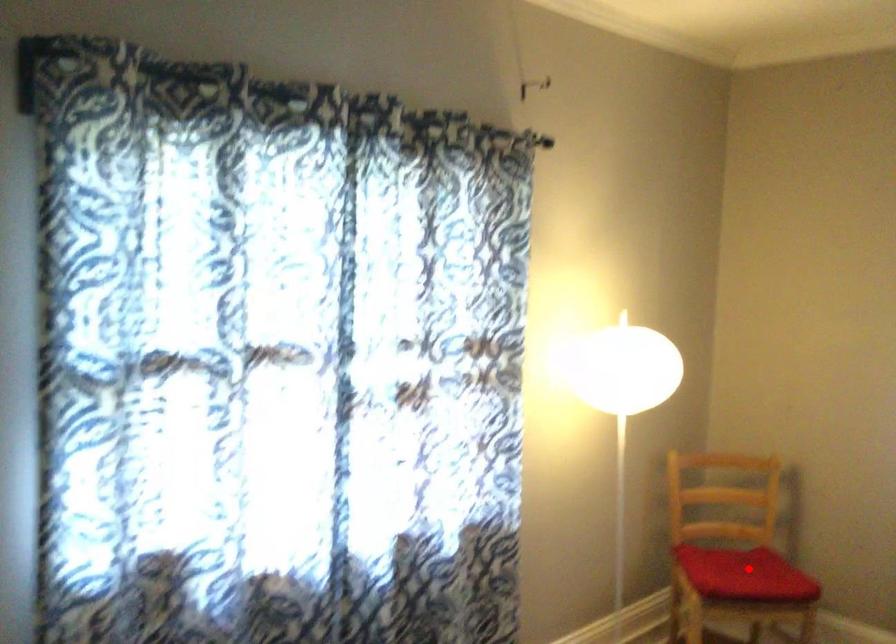
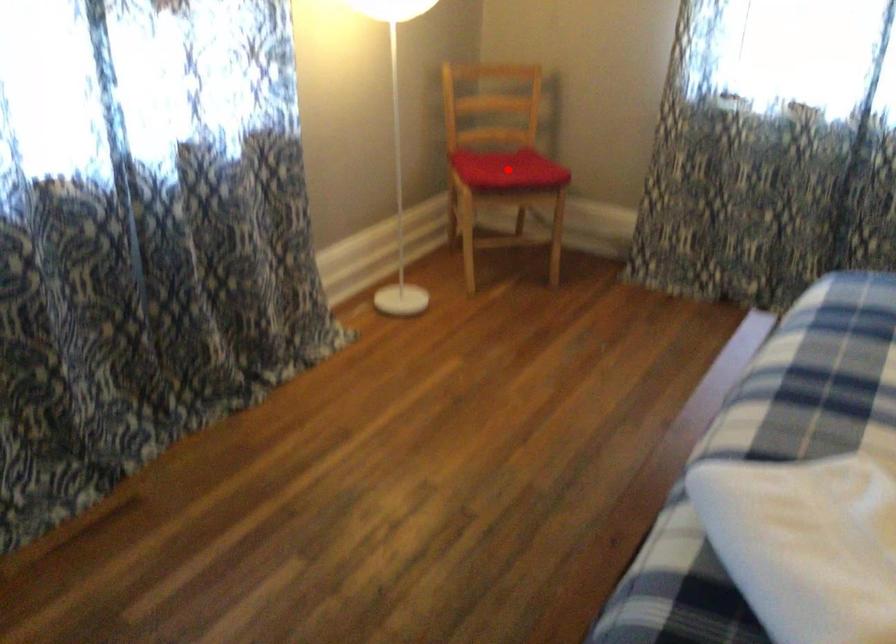
I am providing you with two images of the same scene from different viewpoints. A red point is marked on the first image and another point is marked on the second image. Is the red point in image1 aligned with the point shown in image2?

Yes